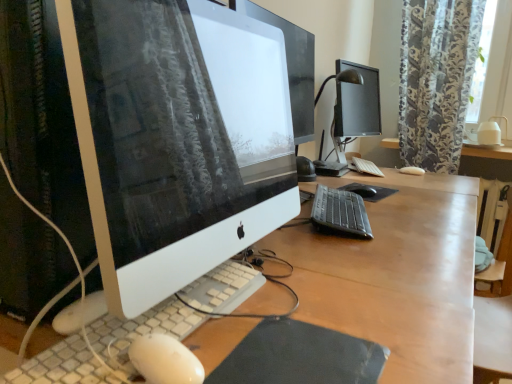
At what (x,y) coordinates should I click in order to perform the action: click on free space to the back side of black matte mousepad at lower center, the 1th mousepad in the front-to-back sequence. Please return your answer as a coordinate pair (x, y). Looking at the image, I should click on point(308,305).